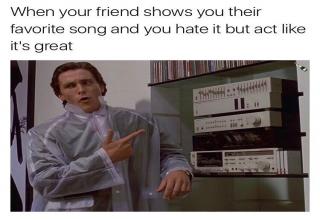
The height and width of the screenshot is (220, 320). I want to click on wall, so (x=118, y=78).